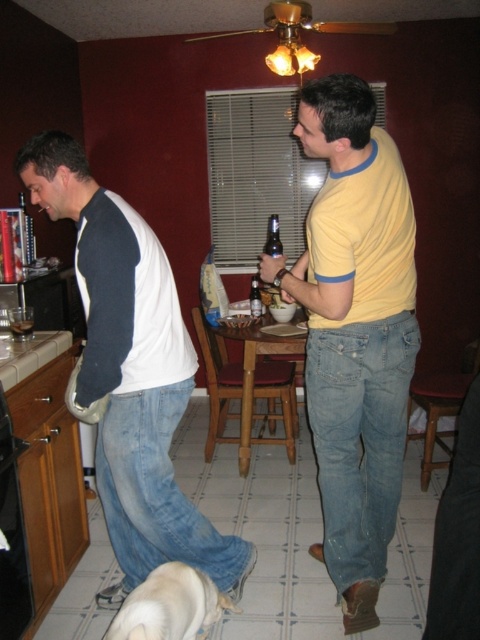
You are a photographer setting up a shot in this room. You need to ensure that the white cotton shirt at left and the matte plastic cup at lower left are both in focus. Given their positions, which object should you focus on first to maintain clarity for both?

Since the white cotton shirt at left is taller than the matte plastic cup at lower left, you should focus on the white cotton shirt at left first to ensure both are in focus.

You are a bartender preparing drinks for two customers. The first customer is wearing a white cotton shirt at left and the second is holding a matte glass beer bottle at center. Which customer is taller?

The white cotton shirt at left is much taller as matte glass beer bottle at center, so the first customer wearing the white cotton shirt at left is taller than the second customer holding the matte glass beer bottle at center.

You are a delivery person who needs to place a small package between the white cotton shirt at left and the matte plastic cup at lower left. The package is 12 inches long. Can you fit it between them?

The distance between the white cotton shirt at left and the matte plastic cup at lower left is 29.22 inches. Since the package is only 12 inches long, there is enough space to fit it between them.